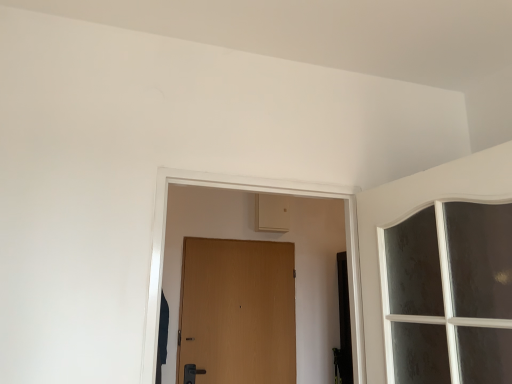
Question: In terms of height, does white textured glass window at upper right look taller or shorter compared to wooden door at center?

Choices:
 (A) short
 (B) tall

Answer: (A)

Question: From the image's perspective, is white textured glass window at upper right positioned above or below wooden door at center?

Choices:
 (A) above
 (B) below

Answer: (A)

Question: Is white textured glass window at upper right wider or thinner than wooden door at center?

Choices:
 (A) wide
 (B) thin

Answer: (A)

Question: Considering their positions, is wooden door at center located in front of or behind white textured glass window at upper right?

Choices:
 (A) behind
 (B) front

Answer: (A)

Question: In the image, is wooden door at center on the left side or the right side of white textured glass window at upper right?

Choices:
 (A) right
 (B) left

Answer: (B)

Question: Considering the positions of wooden door at center and white textured glass window at upper right in the image, is wooden door at center wider or thinner than white textured glass window at upper right?

Choices:
 (A) wide
 (B) thin

Answer: (B)

Question: From a real-world perspective, relative to white textured glass window at upper right, is wooden door at center vertically above or below?

Choices:
 (A) above
 (B) below

Answer: (B)